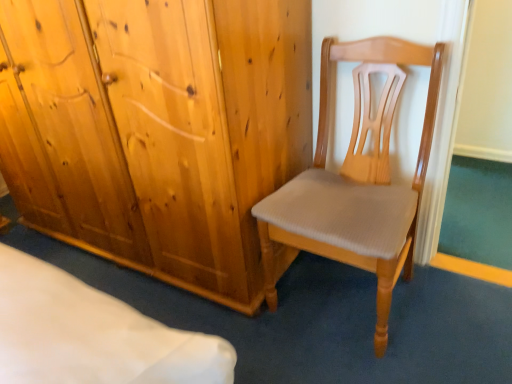
Locate an element on the screen. This screenshot has width=512, height=384. vacant space to the right of light brown wood chair at center is located at coordinates (458, 311).